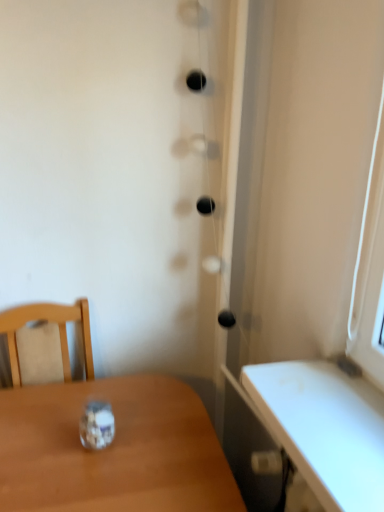
Question: Should I look upward or downward to see clear glass jar at center?

Choices:
 (A) up
 (B) down

Answer: (B)

Question: Considering the relative sizes of clear glass jar at center and wooden table at lower left in the image provided, is clear glass jar at center smaller than wooden table at lower left?

Choices:
 (A) yes
 (B) no

Answer: (A)

Question: From a real-world perspective, is clear glass jar at center on wooden table at lower left?

Choices:
 (A) no
 (B) yes

Answer: (B)

Question: Does clear glass jar at center have a lesser width compared to wooden table at lower left?

Choices:
 (A) yes
 (B) no

Answer: (A)

Question: Is clear glass jar at center not within wooden table at lower left?

Choices:
 (A) yes
 (B) no

Answer: (A)

Question: Is clear glass jar at center at the left side of wooden table at lower left?

Choices:
 (A) no
 (B) yes

Answer: (B)

Question: Can you confirm if clear glass jar at center is positioned to the right of wooden table at lower left?

Choices:
 (A) yes
 (B) no

Answer: (B)

Question: From the image's perspective, is wooden table at lower left below clear glass jar at center?

Choices:
 (A) yes
 (B) no

Answer: (A)

Question: From the image's perspective, is wooden table at lower left above clear glass jar at center?

Choices:
 (A) yes
 (B) no

Answer: (B)

Question: Is clear glass jar at center at the back of wooden table at lower left?

Choices:
 (A) no
 (B) yes

Answer: (A)

Question: From a real-world perspective, is wooden table at lower left on clear glass jar at center?

Choices:
 (A) yes
 (B) no

Answer: (B)

Question: Can clear glass jar at center be found inside wooden table at lower left?

Choices:
 (A) yes
 (B) no

Answer: (B)

Question: Does wooden table at lower left lie behind clear glass jar at center?

Choices:
 (A) no
 (B) yes

Answer: (A)

Question: Looking at their shapes, would you say wooden table at lower left is wider or thinner than clear glass jar at center?

Choices:
 (A) wide
 (B) thin

Answer: (A)